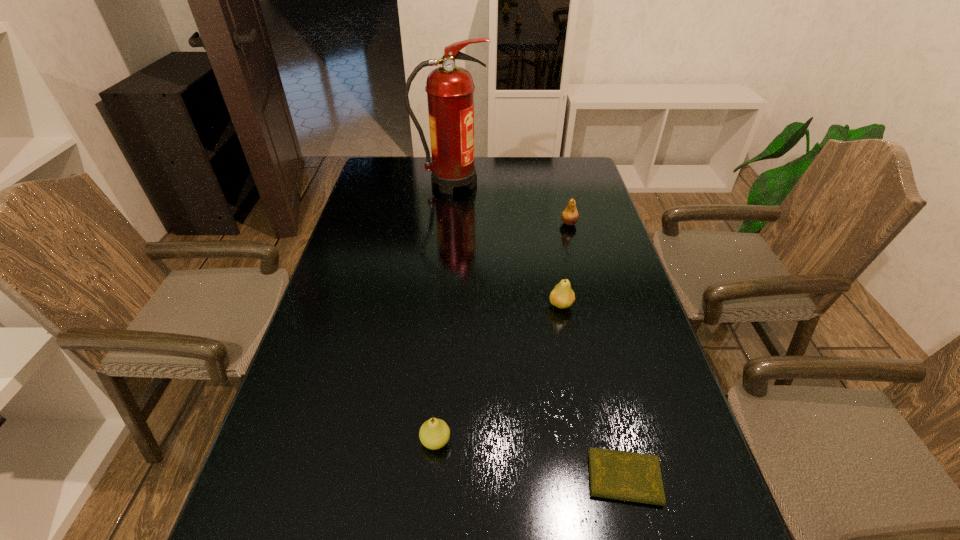
This screenshot has height=540, width=960. In order to click on empty space between the rightmost pear and the leftmost pear in this screenshot , I will do `click(502, 332)`.

Locate an element on the screen. The height and width of the screenshot is (540, 960). the third closest object to the second pear from left to right is located at coordinates (434, 433).

Where is `object that is the second closest to the shortest object`? object that is the second closest to the shortest object is located at coordinates (562, 296).

Where is `the second closest pear to the fourth nearest object`? The image size is (960, 540). the second closest pear to the fourth nearest object is located at coordinates (434, 433).

The height and width of the screenshot is (540, 960). What are the coordinates of `the second closest pear to the second pear from right to left` in the screenshot? It's located at (434, 433).

Where is `vacant space that satisfies the following two spatial constraints: 1. on the front-facing side of the fire extinguisher; 2. on the right side of the farthest pear`? This screenshot has height=540, width=960. vacant space that satisfies the following two spatial constraints: 1. on the front-facing side of the fire extinguisher; 2. on the right side of the farthest pear is located at coordinates pyautogui.click(x=447, y=224).

At what (x,y) coordinates should I click in order to perform the action: click on free space that satisfies the following two spatial constraints: 1. on the front-facing side of the farthest object; 2. on the right side of the second pear from left to right. Please return your answer as a coordinate pair (x, y). The image size is (960, 540). Looking at the image, I should click on (440, 305).

The width and height of the screenshot is (960, 540). I want to click on free spot that satisfies the following two spatial constraints: 1. on the front-facing side of the tallest object; 2. on the left side of the third farthest object, so click(x=440, y=305).

Find the location of a particular element. vacant area in the image that satisfies the following two spatial constraints: 1. on the back side of the shortest object; 2. on the front-facing side of the tallest object is located at coordinates (553, 183).

This screenshot has height=540, width=960. I want to click on free space that satisfies the following two spatial constraints: 1. on the front-facing side of the leftmost pear; 2. on the right side of the fire extinguisher, so click(x=427, y=441).